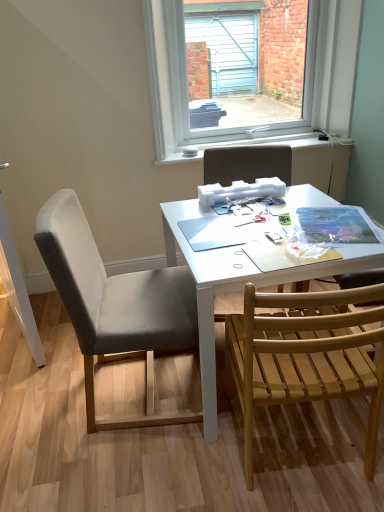
Where is `vacant point above white matte table at center (from a real-world perspective)`? vacant point above white matte table at center (from a real-world perspective) is located at coordinates (265, 219).